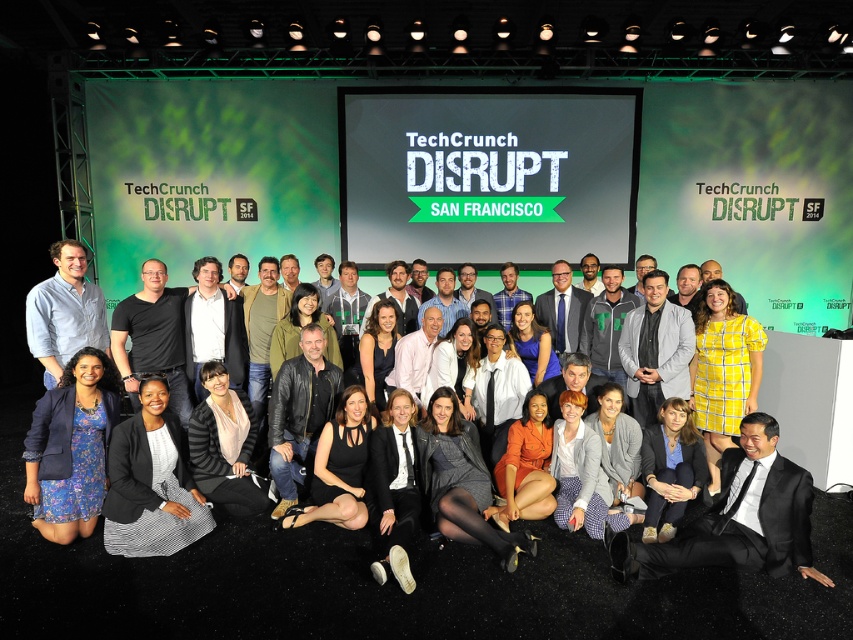
You are at the TechCrunch Disrupt event in San Francisco 2014 and you see a group photo being taken. You notice a black satin suit at lower right and a blue floral dress at lower left. Which one is positioned to the right of the other?

The black satin suit at lower right is positioned to the right of the blue floral dress at lower left.

You are a photographer at the TechCrunch Disrupt event in 2014. You need to adjust the camera frame to include both the black satin suit at lower right and the blue floral dress at lower left. Considering their sizes, which one should you focus on expanding the frame towards?

The black satin suit at lower right is wider than the blue floral dress at lower left, so you should expand the frame towards the black satin suit at lower right to ensure both are fully captured.

You are a photographer at the TechCrunch Disrupt event in 2014. You notice two attendees wearing a black satin suit at lower right and a blue floral dress at lower left. Which attendee is wearing clothing with a shorter length?

The black satin suit at lower right is shorter than the blue floral dress at lower left, so the attendee wearing the black satin suit at lower right has shorter clothing length.